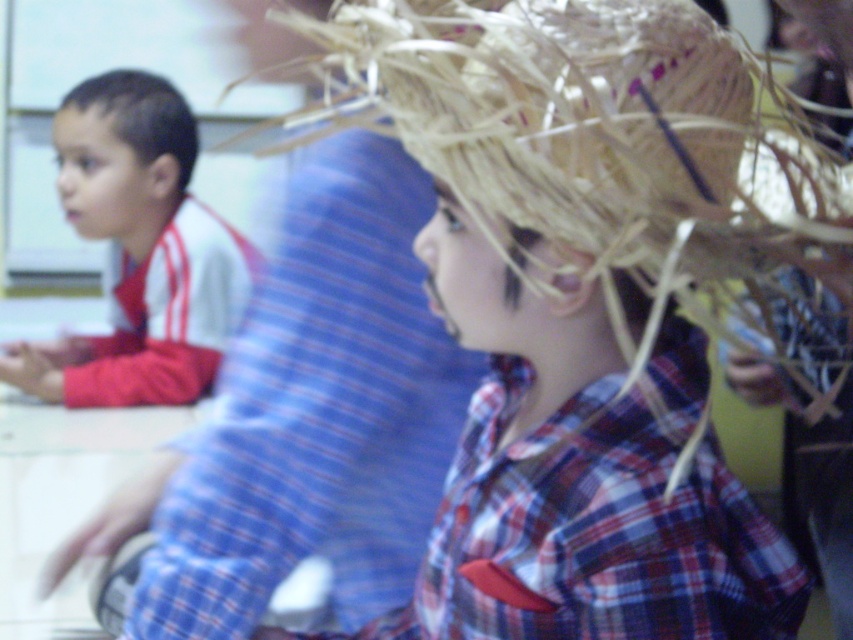
Question: Which of the following is the farthest from the observer?

Choices:
 (A) matte white shirt at left
 (B) plaid fabric at center

Answer: (A)

Question: Can you confirm if matte white shirt at left is positioned below brown matte hair at left?

Choices:
 (A) yes
 (B) no

Answer: (A)

Question: Which point appears closest to the camera in this image?

Choices:
 (A) (331, 140)
 (B) (564, 150)

Answer: (B)

Question: Is the position of straw hat at upper right less distant than that of matte white shirt at left?

Choices:
 (A) no
 (B) yes

Answer: (B)

Question: Estimate the real-world distances between objects in this image. Which object is farther from the straw hat at upper right?

Choices:
 (A) brown matte hair at left
 (B) plaid fabric at center
 (C) matte white shirt at left

Answer: (A)

Question: Can you confirm if matte white shirt at left is wider than brown matte hair at left?

Choices:
 (A) no
 (B) yes

Answer: (B)